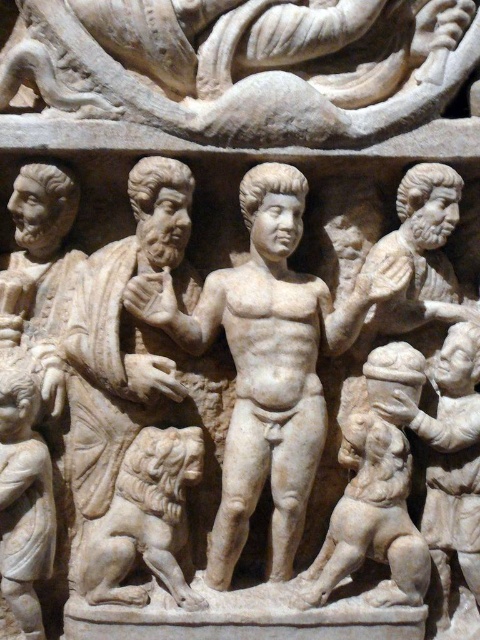
You are an art conservator examining the classical marble relief sculpture. You need to clean both the white marble snake at upper center and the white marble lion at lower left. Which one should you start with if you want to work from the closest to the farthest object first?

The white marble snake at upper center is closer to the viewer than the white marble lion at lower left, so you should start cleaning the white marble snake at upper center first.

You are an art conservator examining the classical marble relief sculpture. You need to determine the position of the white marble snake at upper center relative to the central figure. Based on the coordinates provided in the description, can you determine if the snake is positioned to the left or right of the central figure?

The white marble snake at upper center is located at coordinates point (243, 65). Since the central figure is at the center of the relief, the snake is positioned to the left of the central figure.